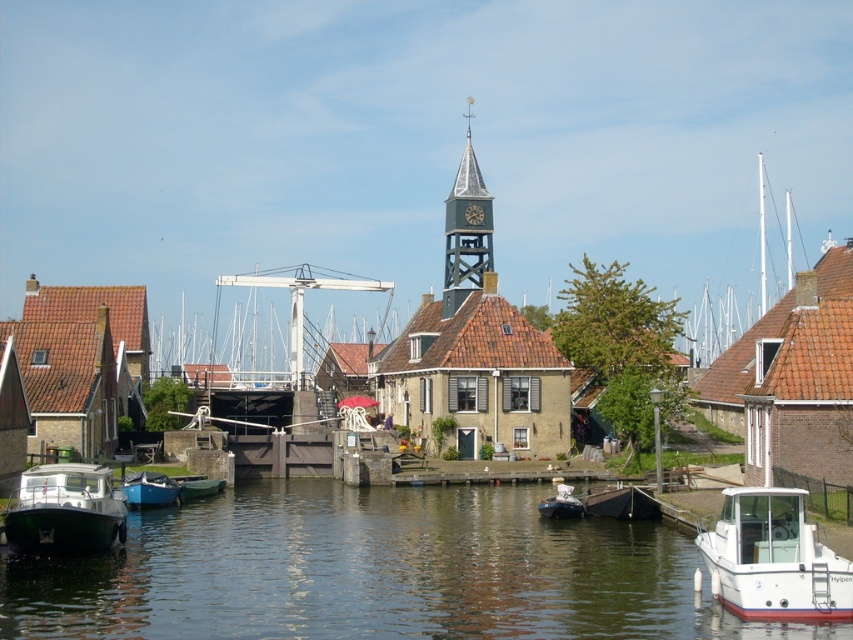
Question: Is white glossy boat at lower right wider than blue matte boat at lower left?

Choices:
 (A) no
 (B) yes

Answer: (B)

Question: Does white glossy boat at lower right have a lesser width compared to green rubber dinghy at lower left?

Choices:
 (A) no
 (B) yes

Answer: (A)

Question: Which object is the closest to the blue matte boat at lower left?

Choices:
 (A) black glossy boat at lower left
 (B) greenish water at lower left
 (C) matte black boat at center

Answer: (A)

Question: Which point appears farthest from the camera in this image?

Choices:
 (A) (460, 179)
 (B) (619, 515)
 (C) (64, 490)

Answer: (A)

Question: Which point appears farthest from the camera in this image?

Choices:
 (A) (74, 468)
 (B) (616, 509)
 (C) (521, 541)

Answer: (B)

Question: Does greenish water at lower left appear on the right side of white glossy boat at lower right?

Choices:
 (A) no
 (B) yes

Answer: (A)